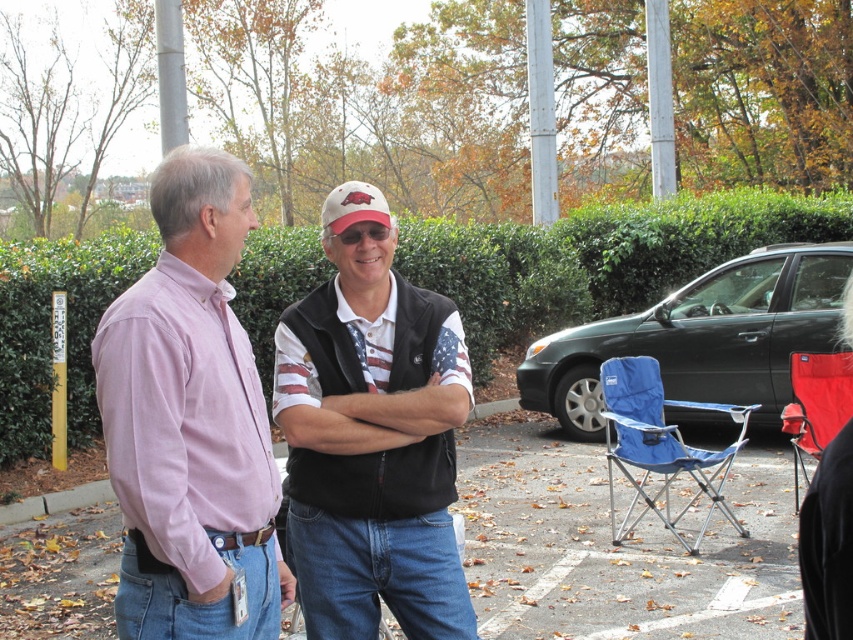
You are standing at the point with coordinates point (247, 556) and want to walk towards the point with coordinates point (405, 356). Which direction should you move?

You should move backward since point (247, 556) is in front of point (405, 356).

You are a photographer trying to capture a photo of the two people in the parking lot. You notice the american flag fabric vest at center and the white matte baseball cap at center. Which object is located to the right of the other?

The american flag fabric vest at center is positioned on the right side of white matte baseball cap at center, so the vest is to the right of the cap.

You are a photographer trying to capture a closeup shot of both the pink cotton shirt at center and the american flag fabric vest at center. Which clothing item should you zoom in on first to ensure it fits within your camera frame?

The pink cotton shirt at center has a lesser width compared to the american flag fabric vest at center, so you should zoom in on the pink cotton shirt at center first to ensure it fits within the camera frame before adjusting for the larger vest.